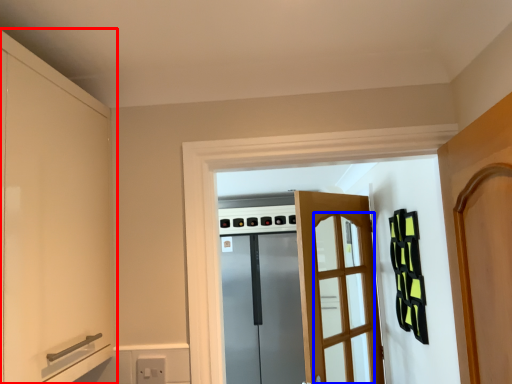
Question: Which object is further to the camera taking this photo, cabinetry (highlighted by a red box) or screen door (highlighted by a blue box)?

Choices:
 (A) cabinetry
 (B) screen door

Answer: (B)